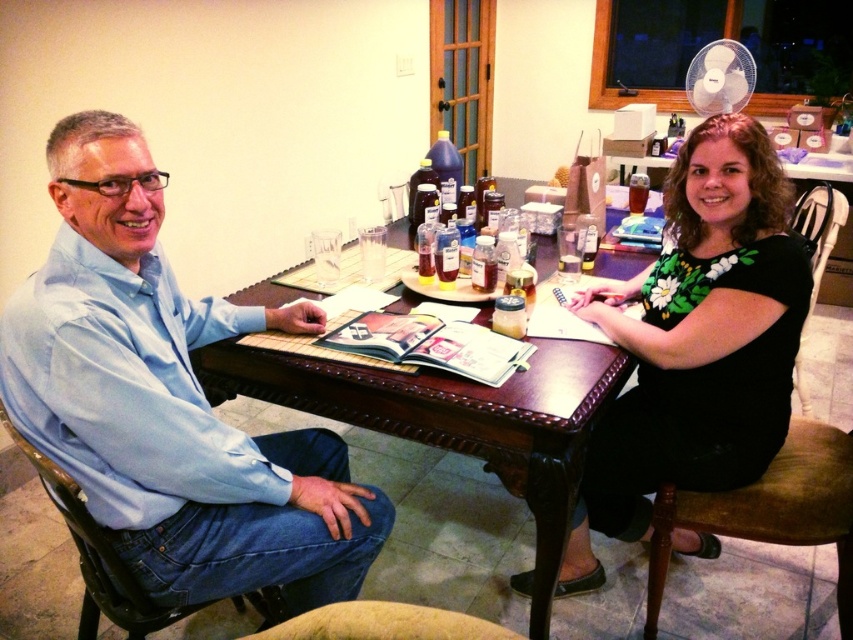
Question: Which object is farther from the camera taking this photo?

Choices:
 (A) brown leather chair at lower center
 (B) black floral dress at center
 (C) light blue shirt at left
 (D) brown wooden table at center

Answer: (B)

Question: Is light blue shirt at left to the left of black floral dress at center from the viewer's perspective?

Choices:
 (A) no
 (B) yes

Answer: (B)

Question: Among these objects, which one is nearest to the camera?

Choices:
 (A) brown wooden table at center
 (B) light blue shirt at left

Answer: (B)

Question: Is brown wooden table at center behind brown leather chair at lower center?

Choices:
 (A) yes
 (B) no

Answer: (A)

Question: Based on their relative distances, which object is farther from the brown wooden table at center?

Choices:
 (A) brown leather chair at lower center
 (B) black floral dress at center

Answer: (A)

Question: Does black floral dress at center have a lesser width compared to brown wooden table at center?

Choices:
 (A) yes
 (B) no

Answer: (A)